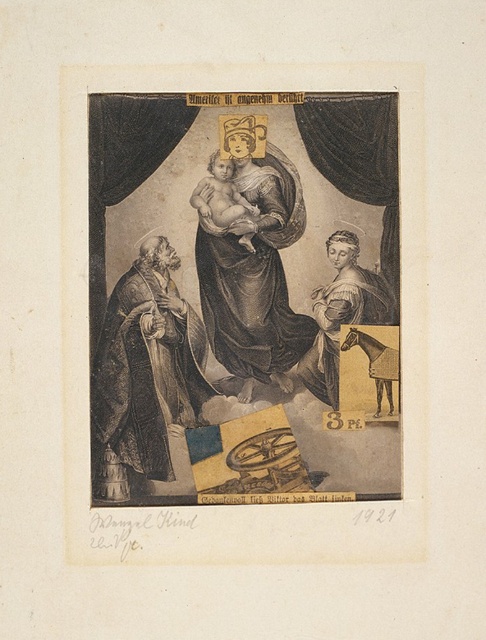
Question: Which object is positioned farthest from the smooth gold statue at right?

Choices:
 (A) smooth brown robe at left
 (B) smooth flesh baby at center

Answer: (A)

Question: Is black velvet curtain at upper center below smooth flesh baby at center?

Choices:
 (A) no
 (B) yes

Answer: (A)

Question: Which of these objects is positioned closest to the matte gold halo at upper center?

Choices:
 (A) matte gold halo at center
 (B) smooth gold statue at right
 (C) black velvet curtain at left

Answer: (A)

Question: Is the position of smooth brown robe at left less distant than that of smooth flesh baby at center?

Choices:
 (A) no
 (B) yes

Answer: (B)

Question: In this image, where is black velvet curtain at upper center located relative to smooth flesh baby at center?

Choices:
 (A) below
 (B) above

Answer: (B)

Question: Among these points, which one is farthest from the camera?

Choices:
 (A) (104, 112)
 (B) (391, 156)

Answer: (B)